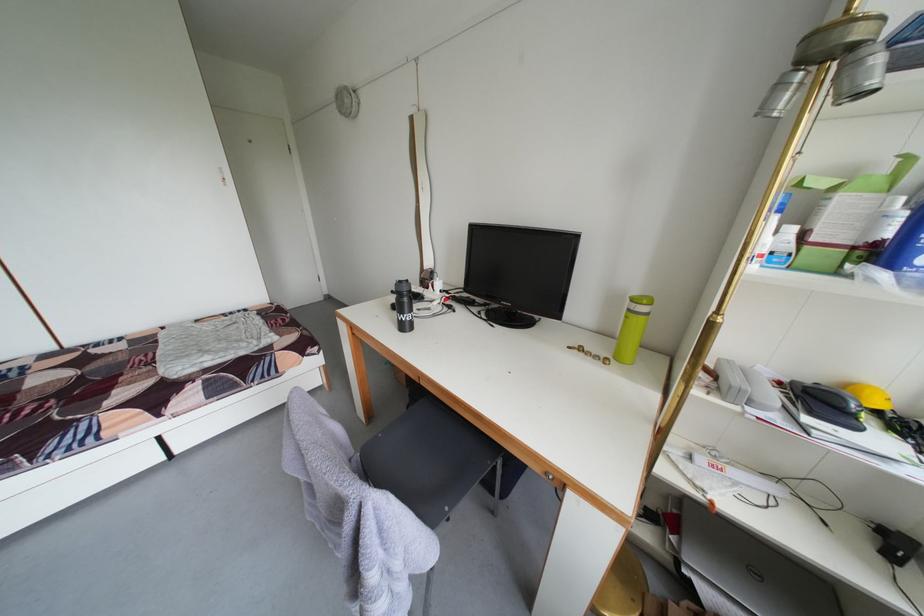
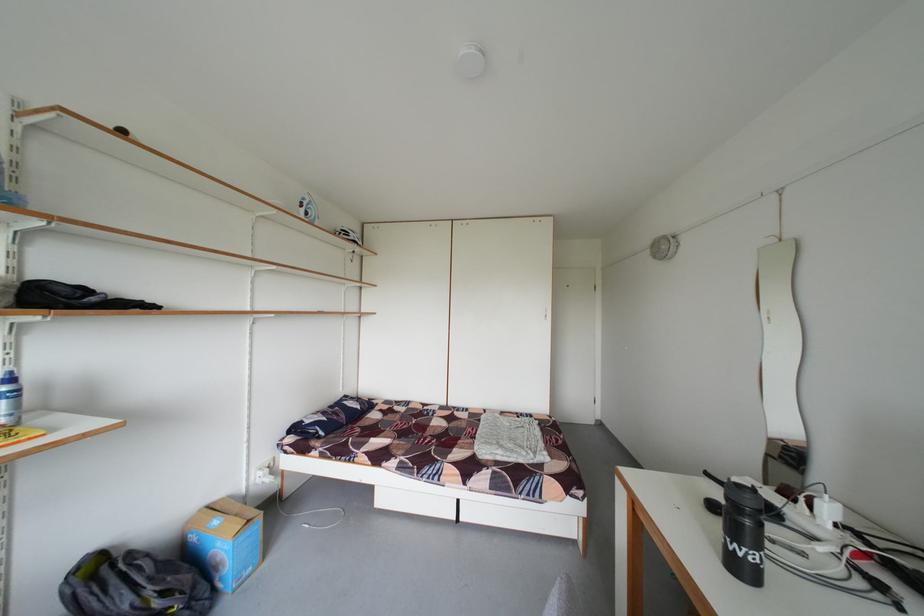
Question: The first image is from the beginning of the video and the second image is from the end. How did the camera likely rotate when shooting the video?

Choices:
 (A) Left
 (B) Right
 (C) Up
 (D) Down

Answer: (A)